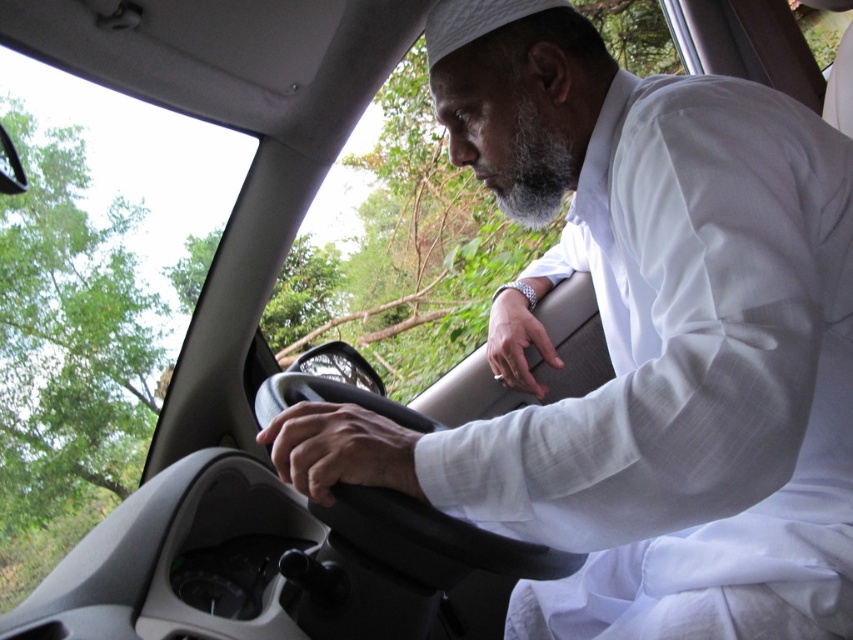
Question: Does white silk robe at center lie in front of smooth skin hand at center?

Choices:
 (A) yes
 (B) no

Answer: (A)

Question: Does white silk robe at center have a lesser width compared to silver metallic wristwatch at center?

Choices:
 (A) yes
 (B) no

Answer: (B)

Question: Which of these objects is positioned closest to the silver metallic wristwatch at center?

Choices:
 (A) white silk robe at center
 (B) smooth skin hand at center

Answer: (A)

Question: Does white silk robe at center have a larger size compared to silver metallic wristwatch at center?

Choices:
 (A) yes
 (B) no

Answer: (A)

Question: Which point appears closest to the camera in this image?

Choices:
 (A) (521, 314)
 (B) (390, 456)
 (C) (608, 497)

Answer: (C)

Question: Which object appears closest to the camera in this image?

Choices:
 (A) white silk robe at center
 (B) silver metallic wristwatch at center

Answer: (A)